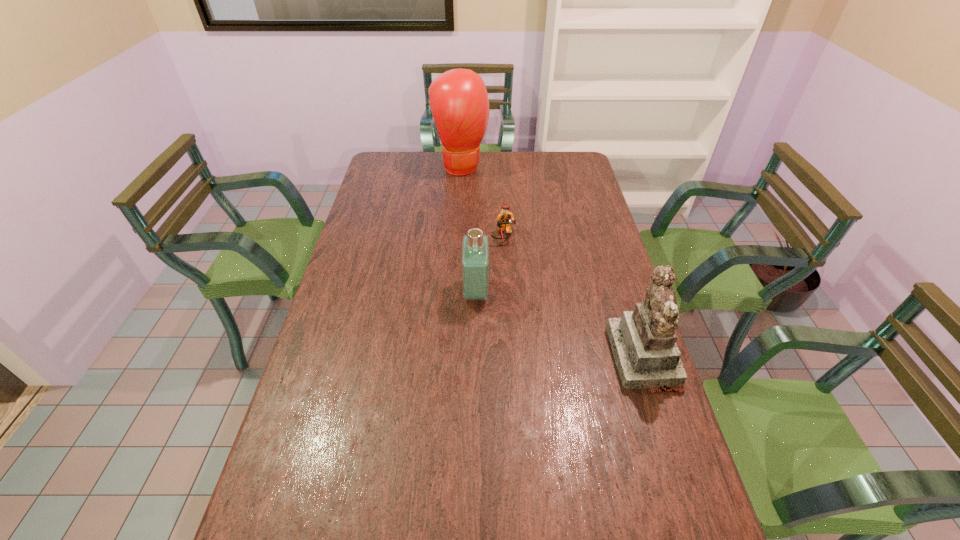
I want to click on vacant space located on the front-facing side of the rightmost object, so tap(559, 357).

The width and height of the screenshot is (960, 540). I want to click on free space located 0.400m on the front-facing side of the rightmost object, so 468,357.

Where is `free region located 0.100m on the striking surface of the boxing glove`? This screenshot has width=960, height=540. free region located 0.100m on the striking surface of the boxing glove is located at coordinates (477, 193).

Find the location of a particular element. This screenshot has width=960, height=540. free region located on the striking surface of the boxing glove is located at coordinates (499, 231).

Identify the location of free space located 0.140m on the striking surface of the boxing glove. The height and width of the screenshot is (540, 960). (480, 199).

Where is `vacant position located 0.290m holding a crossbow in the hands of the shortest object`? The width and height of the screenshot is (960, 540). vacant position located 0.290m holding a crossbow in the hands of the shortest object is located at coordinates (531, 305).

Locate an element on the screen. The image size is (960, 540). vacant space situated 0.400m holding a crossbow in the hands of the shortest object is located at coordinates (542, 332).

You are a GUI agent. You are given a task and a screenshot of the screen. Output one action in this format:
    pyautogui.click(x=<x>, y=<y>)
    Task: Click on the free region located holding a crossbow in the hands of the shortest object
    This screenshot has height=540, width=960.
    Given the screenshot: What is the action you would take?
    (527, 294)

Identify the location of object that is at the far edge. This screenshot has width=960, height=540. (459, 102).

The width and height of the screenshot is (960, 540). I want to click on object that is positioned at the right edge, so click(643, 342).